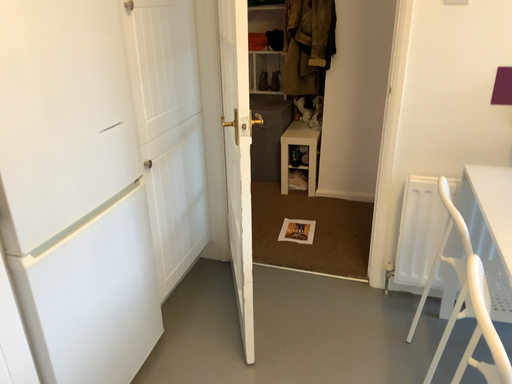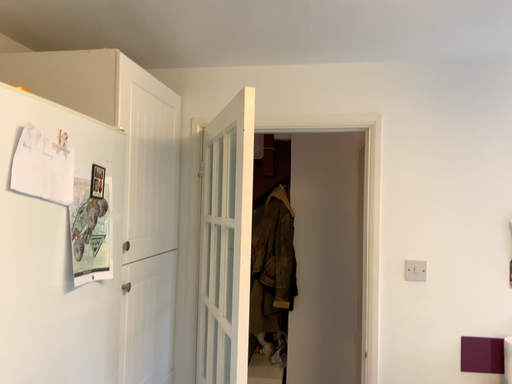
Question: How did the camera likely rotate when shooting the video?

Choices:
 (A) rotated upward
 (B) rotated downward

Answer: (A)